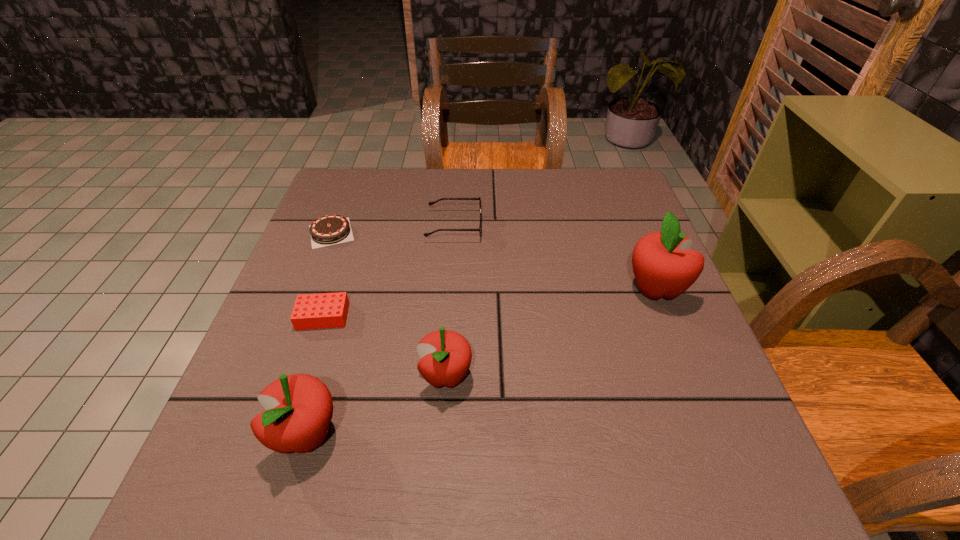
This screenshot has width=960, height=540. Identify the location of free space located on the back of the third tallest object. (453, 272).

I want to click on free space located on the front of the rightmost apple, so click(677, 342).

The width and height of the screenshot is (960, 540). In order to click on vacant space located on the front of the chocolate cake in this screenshot , I will do `click(295, 326)`.

The width and height of the screenshot is (960, 540). I want to click on free spot located on the front lenses of the sunglasses, so click(x=571, y=226).

What are the coordinates of `free space located on the right of the Lego` in the screenshot? It's located at (492, 316).

Where is `object that is at the far edge`? This screenshot has width=960, height=540. object that is at the far edge is located at coordinates (469, 198).

Locate an element on the screen. apple that is at the left edge is located at coordinates (299, 408).

Locate an element on the screen. chocolate cake present at the left edge is located at coordinates (328, 230).

At what (x,y) coordinates should I click in order to perform the action: click on Lego situated at the left edge. Please return your answer as a coordinate pair (x, y). Looking at the image, I should click on (327, 310).

The width and height of the screenshot is (960, 540). In order to click on object that is at the right edge in this screenshot , I will do `click(664, 266)`.